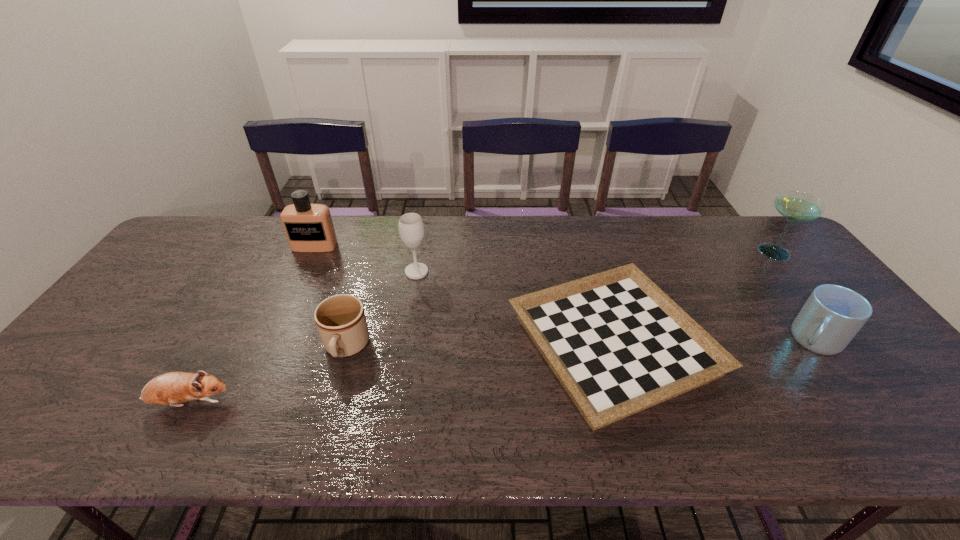
Identify the location of martini that is at the right edge. (795, 206).

Where is `mug present at the right edge`? Image resolution: width=960 pixels, height=540 pixels. mug present at the right edge is located at coordinates (831, 317).

Locate an element on the screen. object positioned at the far right corner is located at coordinates (795, 206).

Identify the location of vacant space at the far edge of the desktop. The height and width of the screenshot is (540, 960). (535, 243).

In the image, there is a desktop. Where is `vacant area at the near edge`? vacant area at the near edge is located at coordinates click(97, 440).

In the image, there is a desktop. Find the location of `free space at the left edge`. free space at the left edge is located at coordinates (155, 307).

The height and width of the screenshot is (540, 960). Find the location of `free space at the right edge of the desktop`. free space at the right edge of the desktop is located at coordinates (900, 383).

Where is `vacant space at the near right corner of the desktop`? This screenshot has height=540, width=960. vacant space at the near right corner of the desktop is located at coordinates (900, 426).

Locate an element on the screen. This screenshot has height=540, width=960. vacant area between the shortest object and the third object from left to right is located at coordinates (479, 347).

Locate an element on the screen. This screenshot has width=960, height=540. vacant area between the martini and the right mug is located at coordinates (x=793, y=295).